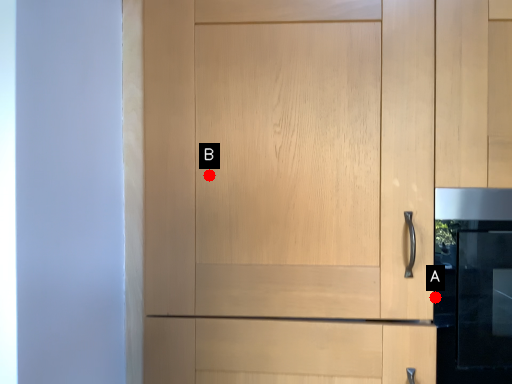
Question: Two points are circled on the image, labeled by A and B beside each circle. Among these points, which one is nearest to the camera?

Choices:
 (A) A is closer
 (B) B is closer

Answer: (A)